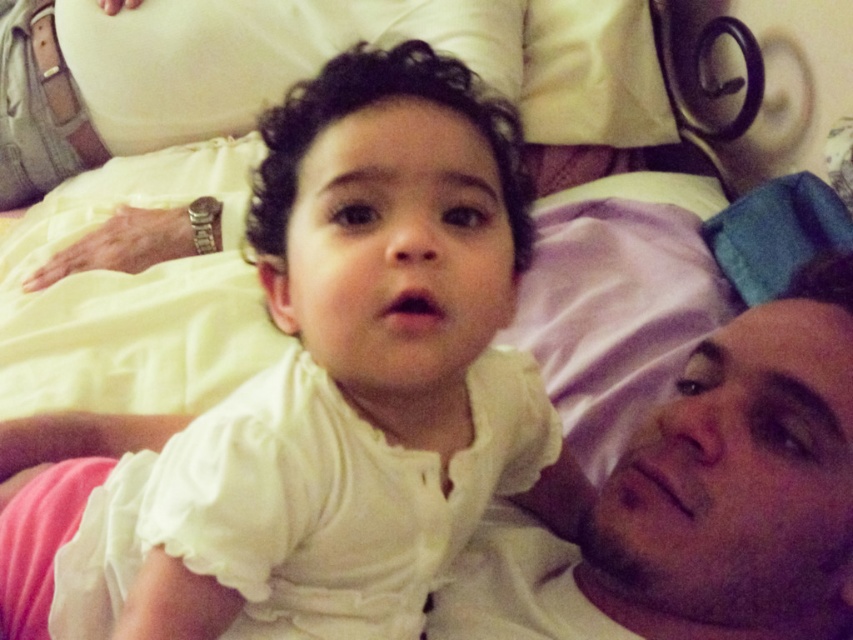
In the scene shown: Between white soft fabric at center and smooth skin face at center, which one is positioned higher?

white soft fabric at center is higher up.

Does point (421, 464) come farther from viewer compared to point (763, 340)?

No, (421, 464) is closer to viewer.

This screenshot has width=853, height=640. I want to click on white soft fabric at center, so click(401, 296).